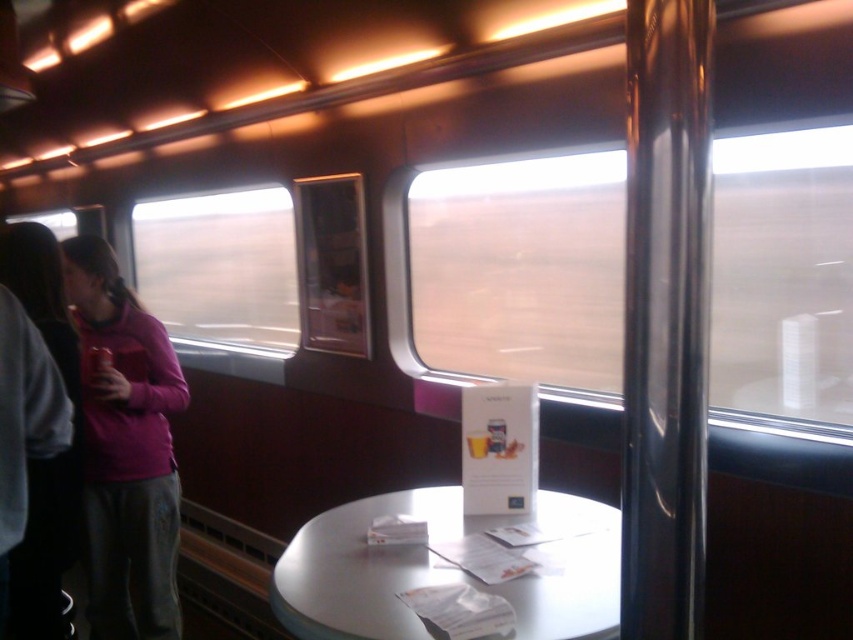
You are a passenger sitting at the table and want to reach the metallic can at left. Is the pink fleece jacket at left blocking your access to it?

The pink fleece jacket at left is in front of the metallic can at left, so it is blocking access to the can.

You are a passenger on the train and want to place a 12 inch long book on the table between the pink fleece jacket at left and the metallic can at left. Will the space between them be sufficient to fit the book?

The space between the pink fleece jacket at left and the metallic can at left is 11.74 inches, which is slightly less than the 12 inch long book. Therefore, the book will not fit between them.